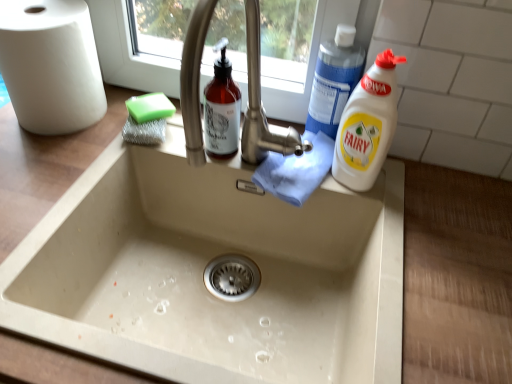
Question: From the image's perspective, would you say blue plastic bottle at upper right, which is counted as the second cleaning product, starting from the bottom, is shown under white plastic bottle at right, the 1th cleaning product when ordered from bottom to top?

Choices:
 (A) no
 (B) yes

Answer: (A)

Question: Does blue plastic bottle at upper right, the 1th cleaning product from the top, appear on the left side of white plastic bottle at right, the 2th cleaning product positioned from the top?

Choices:
 (A) no
 (B) yes

Answer: (B)

Question: Is blue plastic bottle at upper right, the 1th cleaning product from the top, further to the viewer compared to white plastic bottle at right, the 1th cleaning product when ordered from bottom to top?

Choices:
 (A) no
 (B) yes

Answer: (B)

Question: Does blue plastic bottle at upper right, the 1th cleaning product from the top, have a smaller size compared to white plastic bottle at right, the 1th cleaning product when ordered from bottom to top?

Choices:
 (A) no
 (B) yes

Answer: (B)

Question: Does blue plastic bottle at upper right, which is counted as the second cleaning product, starting from the bottom, have a larger size compared to white plastic bottle at right, the 2th cleaning product positioned from the top?

Choices:
 (A) no
 (B) yes

Answer: (A)

Question: From the image's perspective, is blue plastic bottle at upper right, the 1th cleaning product from the top, located above or below green sponge at upper left?

Choices:
 (A) below
 (B) above

Answer: (B)

Question: From their relative heights in the image, would you say blue plastic bottle at upper right, the 1th cleaning product from the top, is taller or shorter than green sponge at upper left?

Choices:
 (A) tall
 (B) short

Answer: (A)

Question: Based on their sizes in the image, would you say blue plastic bottle at upper right, which is counted as the second cleaning product, starting from the bottom, is bigger or smaller than green sponge at upper left?

Choices:
 (A) small
 (B) big

Answer: (B)

Question: Based on their positions, is blue plastic bottle at upper right, the 1th cleaning product from the top, located to the left or right of green sponge at upper left?

Choices:
 (A) left
 (B) right

Answer: (B)

Question: Looking at the image, does blue plastic bottle at upper right, which is counted as the second cleaning product, starting from the bottom, seem bigger or smaller compared to white plastic bottle at right, the 2th cleaning product positioned from the top?

Choices:
 (A) small
 (B) big

Answer: (A)

Question: From a real-world perspective, is blue plastic bottle at upper right, which is counted as the second cleaning product, starting from the bottom, above or below white plastic bottle at right, the 1th cleaning product when ordered from bottom to top?

Choices:
 (A) below
 (B) above

Answer: (B)

Question: In the image, is blue plastic bottle at upper right, the 1th cleaning product from the top, positioned in front of or behind white plastic bottle at right, the 2th cleaning product positioned from the top?

Choices:
 (A) behind
 (B) front

Answer: (A)

Question: Considering the positions of point (337, 114) and point (385, 107), is point (337, 114) closer or farther from the camera than point (385, 107)?

Choices:
 (A) closer
 (B) farther

Answer: (B)

Question: Is green sponge at upper left inside the boundaries of white plastic bottle at right, the 2th cleaning product positioned from the top, or outside?

Choices:
 (A) outside
 (B) inside

Answer: (A)

Question: Relative to white plastic bottle at right, the 1th cleaning product when ordered from bottom to top, is green sponge at upper left in front or behind?

Choices:
 (A) front
 (B) behind

Answer: (B)